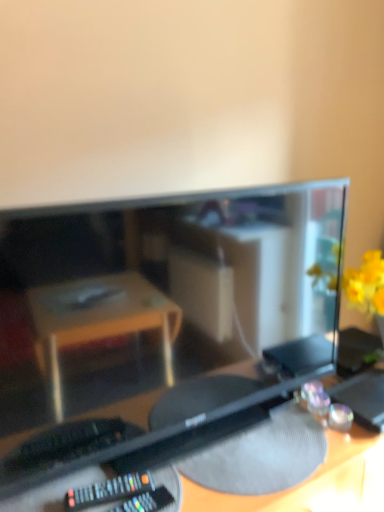
You are a GUI agent. You are given a task and a screenshot of the screen. Output one action in this format:
    pyautogui.click(x=<x>, y=<y>)
    Task: Click on the free point to the right of black plastic remote at lower left
    The height and width of the screenshot is (512, 384).
    Given the screenshot: What is the action you would take?
    pyautogui.click(x=202, y=476)